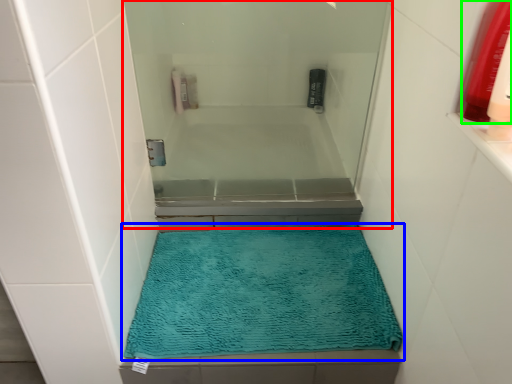
Question: Which object is positioned closest to screen door (highlighted by a red box)? Select from bath mat (highlighted by a blue box) and mouthwash (highlighted by a green box).

Choices:
 (A) bath mat
 (B) mouthwash

Answer: (A)